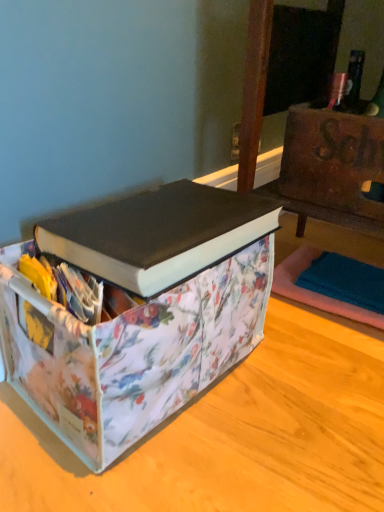
Where is `vacant area that is situated to the right of floral fabric storage bin at center`? The height and width of the screenshot is (512, 384). vacant area that is situated to the right of floral fabric storage bin at center is located at coordinates (300, 391).